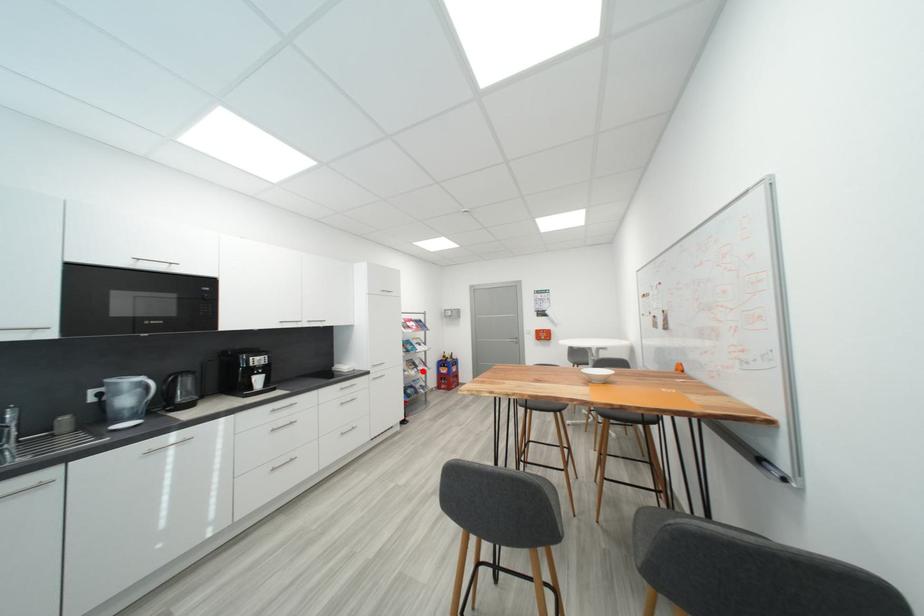
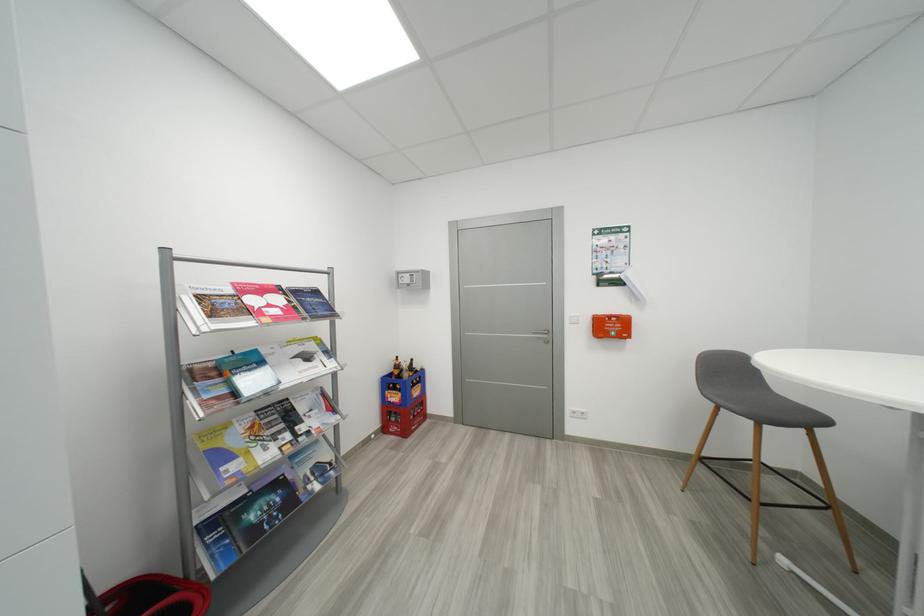
Question: I am providing you with two images of the same scene from different viewpoints. A red point is marked on the first image. Is the red point's position out of view in image 2?

Choices:
 (A) Yes
 (B) No

Answer: (B)